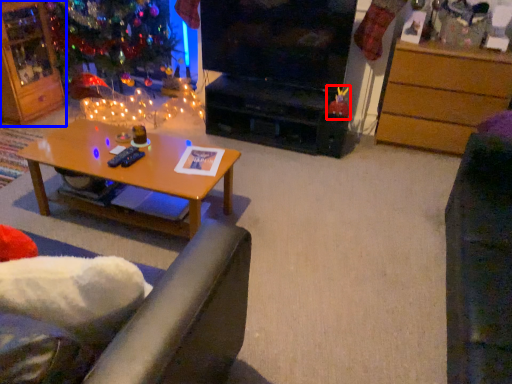
Question: Among these objects, which one is nearest to the camera, toy (highlighted by a red box) or cabinetry (highlighted by a blue box)?

Choices:
 (A) toy
 (B) cabinetry

Answer: (B)